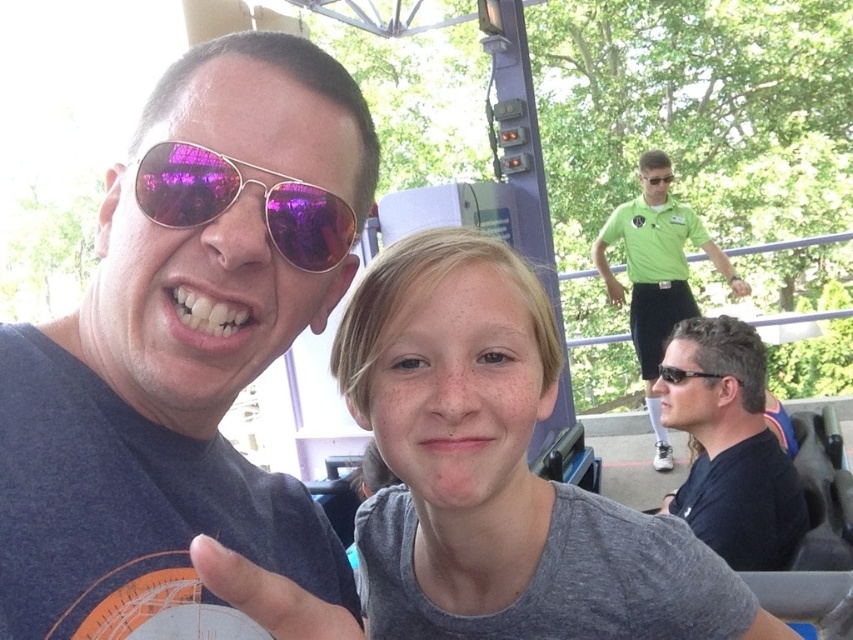
Question: Can you confirm if matte black sunglasses at upper left is positioned below green fabric shirt at upper right?

Choices:
 (A) no
 (B) yes

Answer: (B)

Question: Estimate the real-world distances between objects in this image. Which object is farther from the matte green sunglasses at upper right?

Choices:
 (A) black matte sunglasses at lower right
 (B) black plastic sunglasses at right

Answer: (B)

Question: Based on their relative distances, which object is nearer to the metallic aviator sunglasses at left?

Choices:
 (A) matte black sunglasses at upper left
 (B) black plastic sunglasses at right
 (C) green fabric shirt at upper right
 (D) matte green sunglasses at upper right

Answer: (A)

Question: Can you confirm if gray matte shirt at center is positioned to the right of matte green sunglasses at upper right?

Choices:
 (A) no
 (B) yes

Answer: (A)

Question: Does black matte sunglasses at lower right appear over metallic aviator sunglasses at left?

Choices:
 (A) yes
 (B) no

Answer: (B)

Question: Which point is farther to the camera?

Choices:
 (A) (164, 275)
 (B) (718, 540)
 (C) (270, 211)
 (D) (650, 163)

Answer: (D)